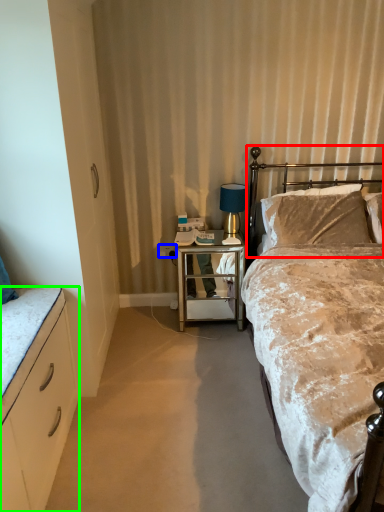
Question: Which is nearer to the headboard (highlighted by a red box)? power outlet (highlighted by a blue box) or cabinetry (highlighted by a green box).

Choices:
 (A) power outlet
 (B) cabinetry

Answer: (A)